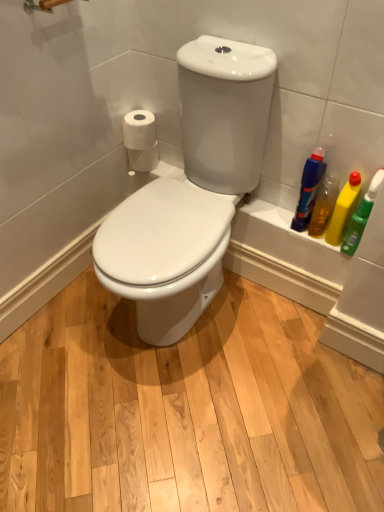
Question: Would you say yellow plastic bottle at right, the third cleaning product from the left, is part of white glossy toilet seat at center's contents?

Choices:
 (A) yes
 (B) no

Answer: (B)

Question: From the image's perspective, is white glossy toilet seat at center on top of yellow plastic bottle at right, marked as the 2th cleaning product in a right-to-left arrangement?

Choices:
 (A) no
 (B) yes

Answer: (A)

Question: Is white glossy toilet seat at center taller than yellow plastic bottle at right, the third cleaning product from the left?

Choices:
 (A) yes
 (B) no

Answer: (A)

Question: From a real-world perspective, is white glossy toilet seat at center below yellow plastic bottle at right, the third cleaning product from the left?

Choices:
 (A) no
 (B) yes

Answer: (B)

Question: From a real-world perspective, is white glossy toilet seat at center on top of yellow plastic bottle at right, marked as the 2th cleaning product in a right-to-left arrangement?

Choices:
 (A) no
 (B) yes

Answer: (A)

Question: Can you confirm if white glossy toilet seat at center is smaller than yellow plastic bottle at right, marked as the 2th cleaning product in a right-to-left arrangement?

Choices:
 (A) no
 (B) yes

Answer: (A)

Question: Can you confirm if white matte toilet paper at upper left, arranged as the second toilet paper when viewed from the back, is bigger than yellow plastic bottle at right, the third cleaning product from the left?

Choices:
 (A) yes
 (B) no

Answer: (A)

Question: Can yellow plastic bottle at right, marked as the 2th cleaning product in a right-to-left arrangement, be found inside white matte toilet paper at upper left, arranged as the second toilet paper when viewed from the back?

Choices:
 (A) no
 (B) yes

Answer: (A)

Question: Does white matte toilet paper at upper left, placed as the 1th toilet paper when sorted from front to back, have a greater height compared to yellow plastic bottle at right, marked as the 2th cleaning product in a right-to-left arrangement?

Choices:
 (A) no
 (B) yes

Answer: (A)

Question: Considering the relative sizes of white matte toilet paper at upper left, placed as the 1th toilet paper when sorted from front to back, and yellow plastic bottle at right, the third cleaning product from the left, in the image provided, is white matte toilet paper at upper left, placed as the 1th toilet paper when sorted from front to back, shorter than yellow plastic bottle at right, the third cleaning product from the left,?

Choices:
 (A) yes
 (B) no

Answer: (A)

Question: Does white matte toilet paper at upper left, arranged as the second toilet paper when viewed from the back, have a lesser width compared to yellow plastic bottle at right, marked as the 2th cleaning product in a right-to-left arrangement?

Choices:
 (A) no
 (B) yes

Answer: (A)

Question: Is white matte toilet paper at upper left, placed as the 1th toilet paper when sorted from front to back, oriented towards yellow plastic bottle at right, the third cleaning product from the left?

Choices:
 (A) yes
 (B) no

Answer: (B)

Question: Does green plastic bottle at right, the 1th cleaning product from the right, turn towards white matte toilet paper at left, acting as the 1th toilet paper starting from the back?

Choices:
 (A) yes
 (B) no

Answer: (B)